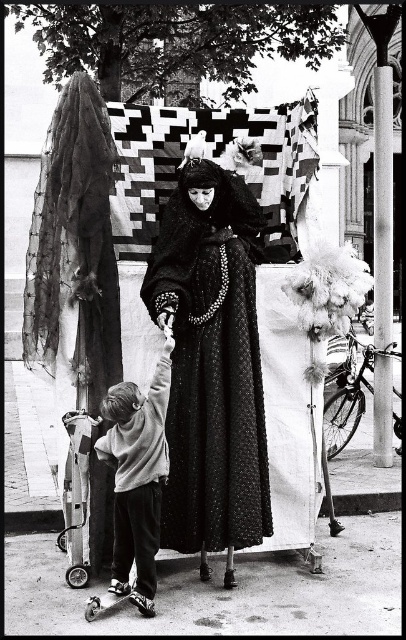
Which of these two, black textured dress at center or light gray sweater at lower left, stands taller?

Standing taller between the two is black textured dress at center.

Can you confirm if black textured dress at center is positioned above light gray sweater at lower left?

Indeed, black textured dress at center is positioned over light gray sweater at lower left.

Which is behind, point (198, 516) or point (99, 452)?

The point (198, 516) is more distant.

Where is `black textured dress at center`? black textured dress at center is located at coordinates (211, 364).